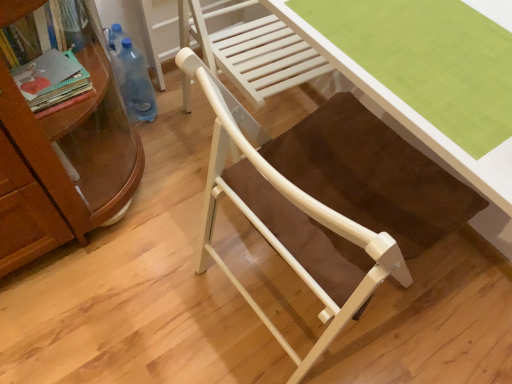
Question: Does matte white chair at center have a lesser height compared to blue plastic bottle at left?

Choices:
 (A) yes
 (B) no

Answer: (B)

Question: Is matte white chair at center looking in the opposite direction of blue plastic bottle at left?

Choices:
 (A) yes
 (B) no

Answer: (B)

Question: Considering the relative sizes of matte white chair at center and blue plastic bottle at left in the image provided, is matte white chair at center wider than blue plastic bottle at left?

Choices:
 (A) yes
 (B) no

Answer: (A)

Question: Is the depth of matte white chair at center less than that of blue plastic bottle at left?

Choices:
 (A) no
 (B) yes

Answer: (B)

Question: Is matte white chair at center outside of blue plastic bottle at left?

Choices:
 (A) no
 (B) yes

Answer: (B)

Question: Does matte white chair at center lie behind blue plastic bottle at left?

Choices:
 (A) no
 (B) yes

Answer: (A)

Question: From the image's perspective, does blue plastic bottle at left appear higher than green fabric desk at center?

Choices:
 (A) no
 (B) yes

Answer: (B)

Question: Is blue plastic bottle at left positioned far away from green fabric desk at center?

Choices:
 (A) yes
 (B) no

Answer: (B)

Question: From a real-world perspective, is blue plastic bottle at left under green fabric desk at center?

Choices:
 (A) yes
 (B) no

Answer: (A)

Question: Is blue plastic bottle at left bigger than green fabric desk at center?

Choices:
 (A) yes
 (B) no

Answer: (A)

Question: Does blue plastic bottle at left have a greater height compared to green fabric desk at center?

Choices:
 (A) yes
 (B) no

Answer: (A)

Question: From a real-world perspective, is blue plastic bottle at left positioned over green fabric desk at center based on gravity?

Choices:
 (A) no
 (B) yes

Answer: (A)

Question: Is green fabric desk at center completely or partially inside matte white chair at center?

Choices:
 (A) yes
 (B) no

Answer: (A)